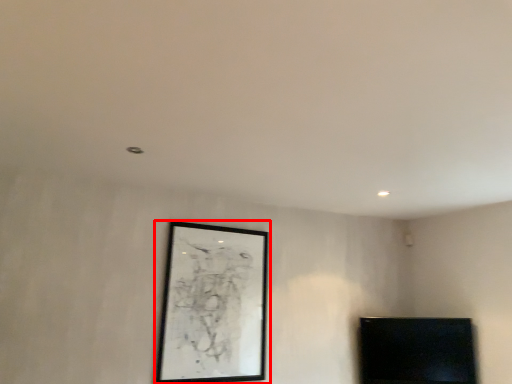
Question: From the image's perspective, considering the relative positions of picture frame (annotated by the red box) and furniture in the image provided, where is picture frame (annotated by the red box) located with respect to the staircase?

Choices:
 (A) below
 (B) above

Answer: (B)